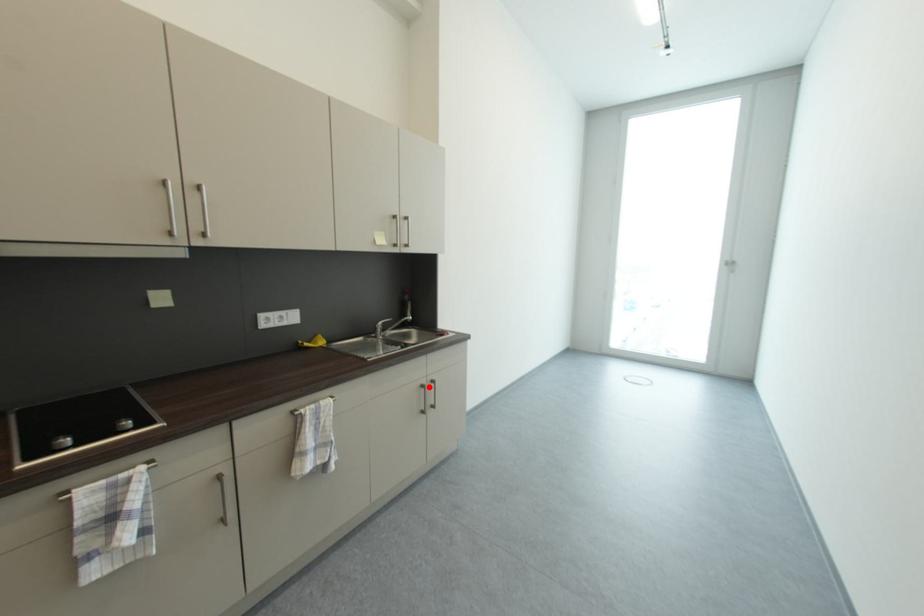
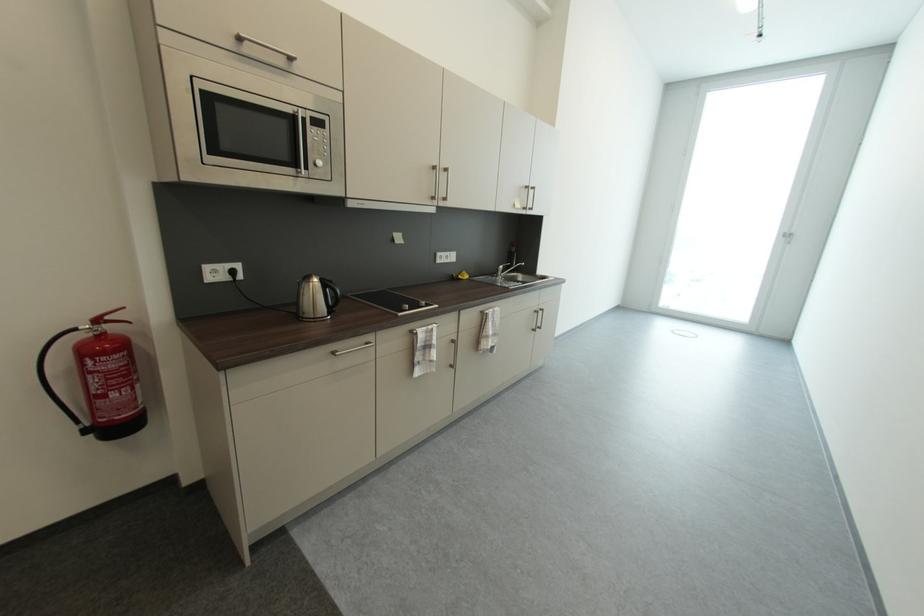
In the second image, find the point that corresponds to the highlighted location in the first image.

(541, 313)